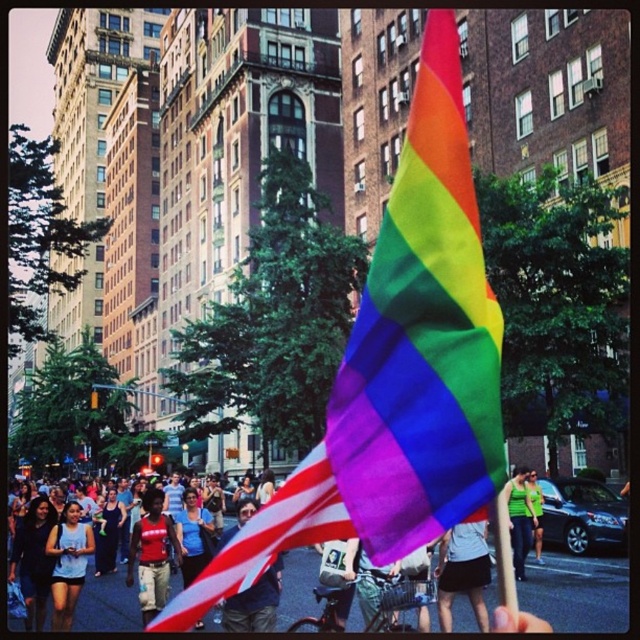
Consider the image. Is american flag at center bigger than green fabric shirt at center?

Indeed, american flag at center has a larger size compared to green fabric shirt at center.

Does american flag at center have a greater height compared to green fabric shirt at center?

Correct, american flag at center is much taller as green fabric shirt at center.

Who is more distant from viewer, [248,515] or [541,502]?

The point [541,502] is more distant.

Image resolution: width=640 pixels, height=640 pixels. I want to click on american flag at center, so click(x=253, y=604).

Between point (266, 604) and point (36, 624), which one is positioned behind?

Point (36, 624)

The width and height of the screenshot is (640, 640). I want to click on matte white flag at center, so click(108, 604).

Does rainbow fabric flag at center come behind green fabric tank top at center?

No, rainbow fabric flag at center is closer to the viewer.

Which is more to the right, rainbow fabric flag at center or green fabric tank top at center?

green fabric tank top at center is more to the right.

Locate an element on the screen. rainbow fabric flag at center is located at coordinates (397, 371).